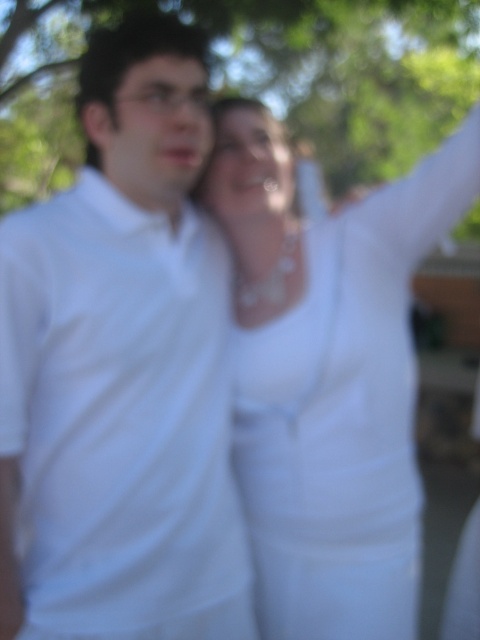
Question: Among these objects, which one is nearest to the camera?

Choices:
 (A) white matte shirt at left
 (B) green leafy tree at upper center

Answer: (A)

Question: Is white matte shirt at left to the left of white fabric dress at upper center from the viewer's perspective?

Choices:
 (A) yes
 (B) no

Answer: (A)

Question: Estimate the real-world distances between objects in this image. Which object is farther from the green leafy tree at upper center?

Choices:
 (A) white matte shirt at left
 (B) white fabric dress at upper center

Answer: (A)

Question: Can you confirm if white matte shirt at left is positioned below green leafy tree at upper center?

Choices:
 (A) no
 (B) yes

Answer: (B)

Question: Which object appears farthest from the camera in this image?

Choices:
 (A) white matte shirt at left
 (B) green leafy tree at upper center
 (C) white fabric dress at upper center

Answer: (B)

Question: Is white matte shirt at left wider than green leafy tree at upper center?

Choices:
 (A) yes
 (B) no

Answer: (B)